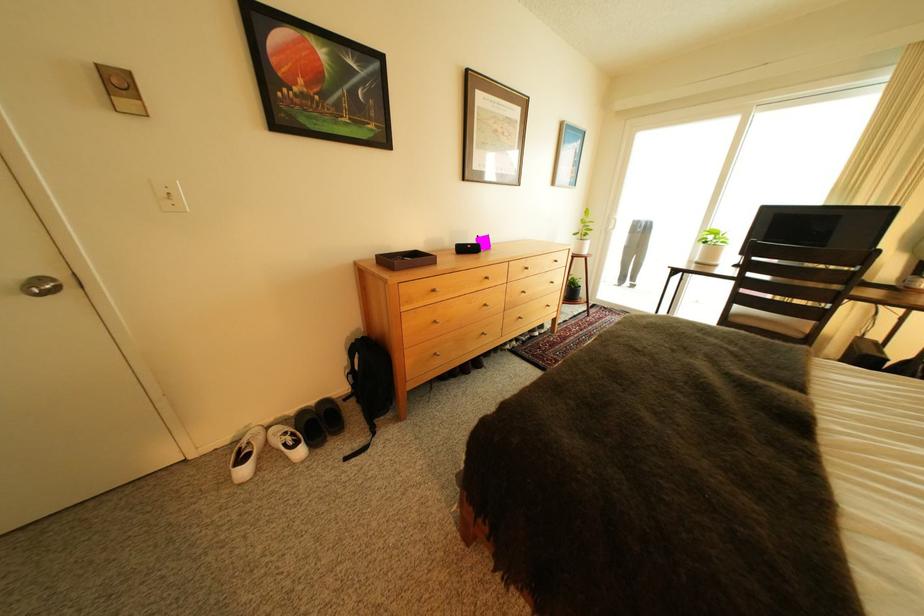
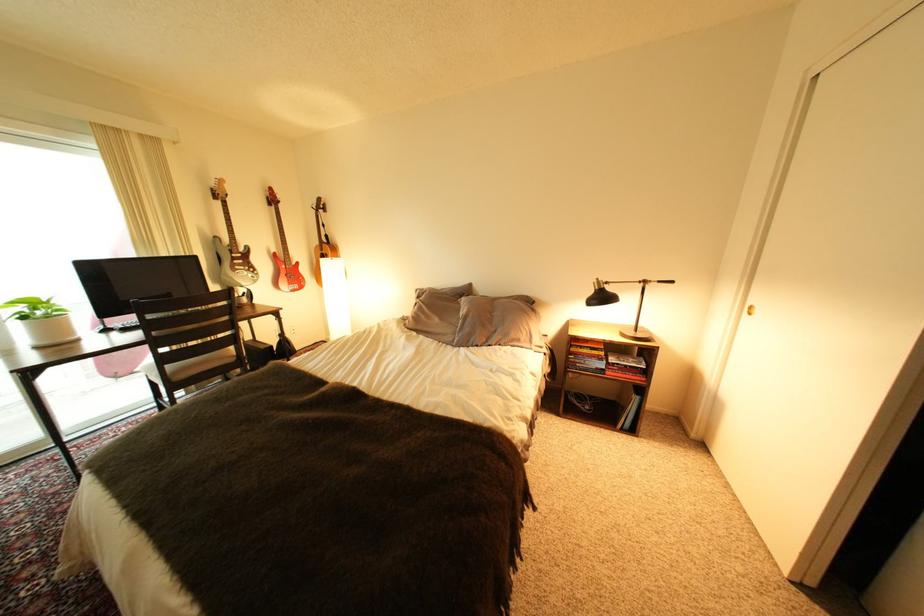
Where in the second image is the point corresponding to [748,307] from the first image?

(178, 368)